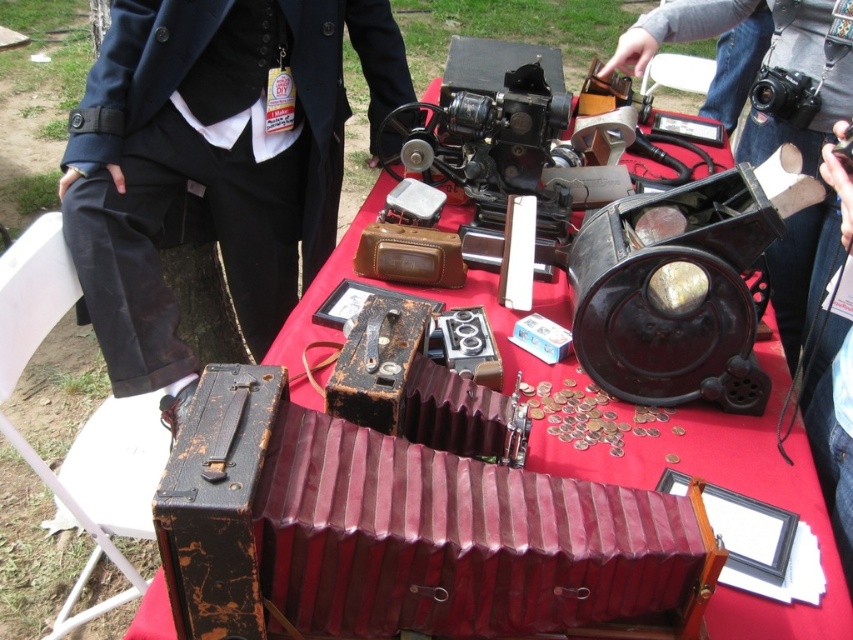
You are standing at the flea market and want to know which of the two points, point (547, 525) or point (730, 17), is closer to you. Based on the scene description, which point is in front?

Point (547, 525) is in front of point (730, 17), so it is closer to you.

You are a vendor at the flea market and need to pack your items. You have a box that can only fit items smaller than the black fabric coat at upper left. Can the matte black camera at center fit in the box?

The black fabric coat at upper left is bigger than the matte black camera at center, so the matte black camera at center is smaller and can fit in the box.